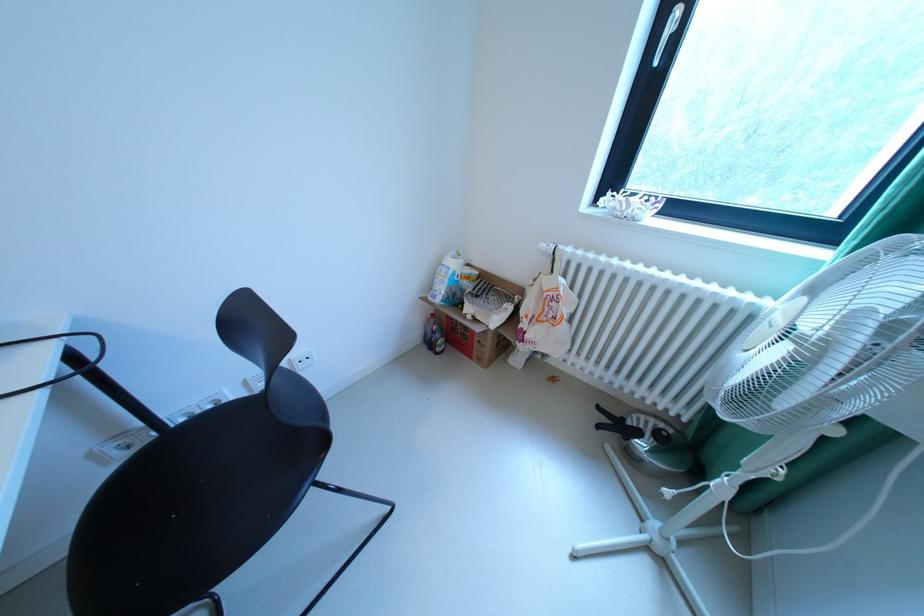
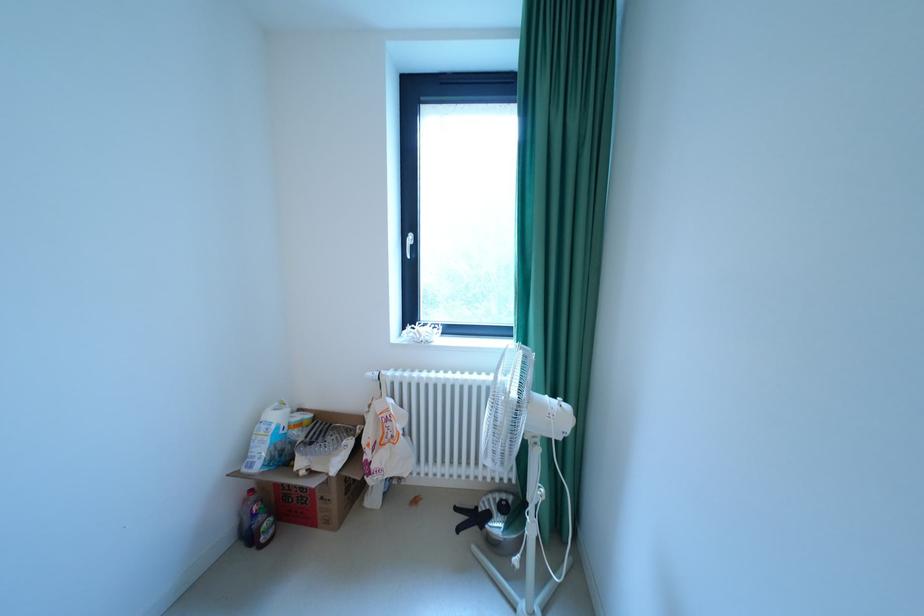
The first image is from the beginning of the video and the second image is from the end. How did the camera likely rotate when shooting the video?

The rotation direction of the camera is right-up.